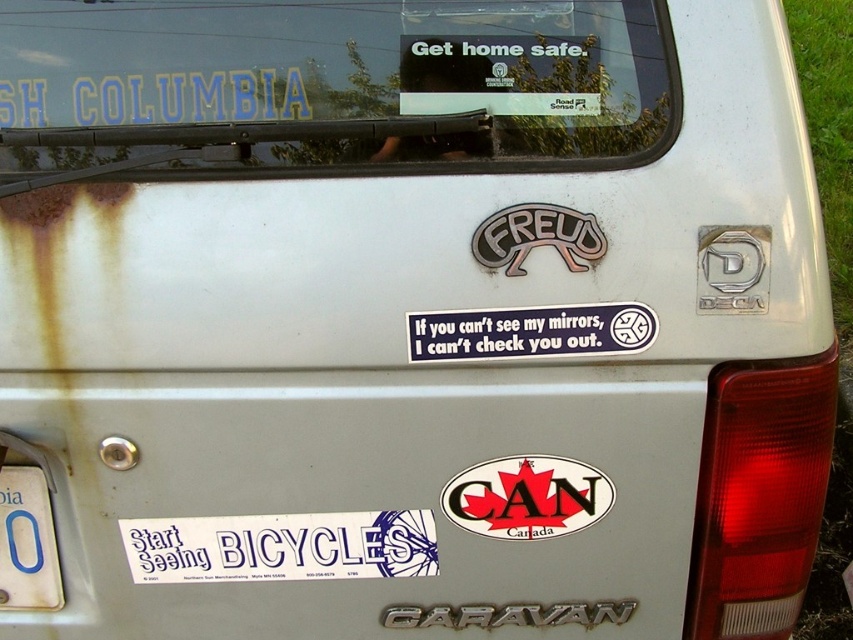
Does transparent glass windshield at upper center appear over blue matte sticker at center?

Correct, transparent glass windshield at upper center is located above blue matte sticker at center.

Which of these two, transparent glass windshield at upper center or blue matte sticker at center, stands taller?

transparent glass windshield at upper center is taller.

Where is `transparent glass windshield at upper center`? Image resolution: width=853 pixels, height=640 pixels. transparent glass windshield at upper center is located at coordinates (329, 88).

Who is shorter, transparent glass windshield at upper center or white plastic license plate at lower left?

Result: Standing shorter between the two is white plastic license plate at lower left.

Does transparent glass windshield at upper center have a greater height compared to white plastic license plate at lower left?

Yes.

What do you see at coordinates (329, 88) in the screenshot? This screenshot has height=640, width=853. I see `transparent glass windshield at upper center` at bounding box center [329, 88].

Identify the location of transparent glass windshield at upper center. (329, 88).

Is point (80, 88) less distant than point (552, 474)?

That is True.

Is point (157, 13) less distant than point (497, 486)?

Yes, point (157, 13) is closer to viewer.

Image resolution: width=853 pixels, height=640 pixels. I want to click on transparent glass windshield at upper center, so click(329, 88).